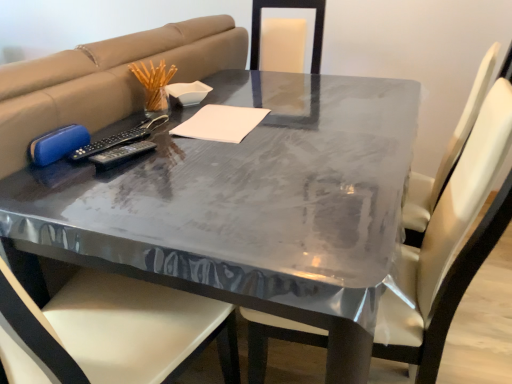
Question: Is glossy plastic table at center facing towards white leather chair at center?

Choices:
 (A) no
 (B) yes

Answer: (B)

Question: Does glossy plastic table at center have a lesser width compared to white leather chair at center?

Choices:
 (A) no
 (B) yes

Answer: (A)

Question: Would you say glossy plastic table at center contains white leather chair at center?

Choices:
 (A) no
 (B) yes

Answer: (B)

Question: Is glossy plastic table at center further to camera compared to white leather chair at center?

Choices:
 (A) yes
 (B) no

Answer: (A)

Question: Considering the relative sizes of glossy plastic table at center and white leather chair at center in the image provided, is glossy plastic table at center bigger than white leather chair at center?

Choices:
 (A) no
 (B) yes

Answer: (B)

Question: Is glossy plastic table at center in front of white leather chair at center?

Choices:
 (A) no
 (B) yes

Answer: (A)

Question: From a real-world perspective, is glossy plastic table at center physically below white paper at center?

Choices:
 (A) yes
 (B) no

Answer: (A)

Question: From the image's perspective, is glossy plastic table at center beneath white paper at center?

Choices:
 (A) yes
 (B) no

Answer: (A)

Question: Does glossy plastic table at center appear on the left side of white paper at center?

Choices:
 (A) yes
 (B) no

Answer: (B)

Question: Is glossy plastic table at center in front of white paper at center?

Choices:
 (A) no
 (B) yes

Answer: (B)

Question: From a real-world perspective, is glossy plastic table at center positioned over white paper at center based on gravity?

Choices:
 (A) no
 (B) yes

Answer: (A)

Question: Would you consider glossy plastic table at center to be distant from white paper at center?

Choices:
 (A) no
 (B) yes

Answer: (A)

Question: Considering the relative positions of white paper at center and black plastic remote at center in the image provided, is white paper at center behind black plastic remote at center?

Choices:
 (A) yes
 (B) no

Answer: (A)